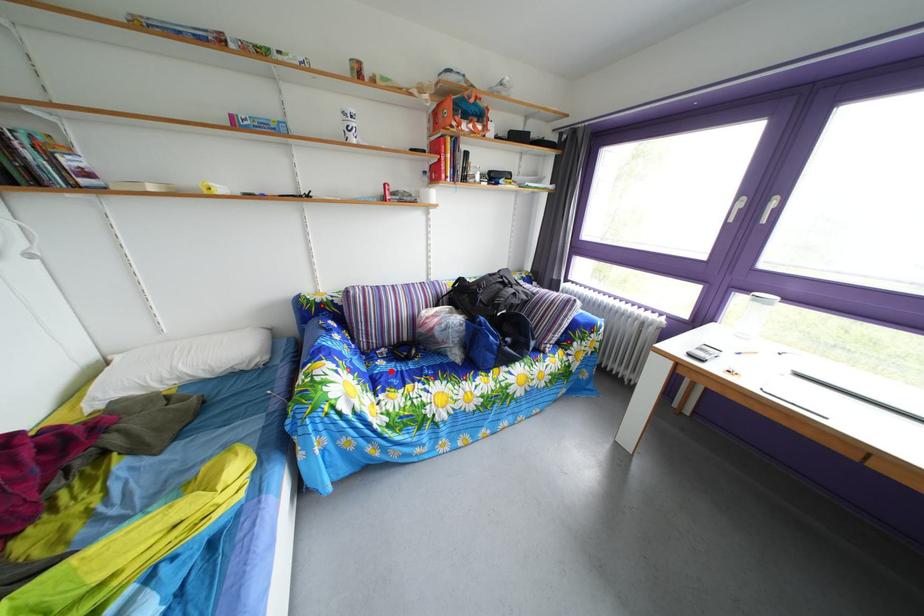
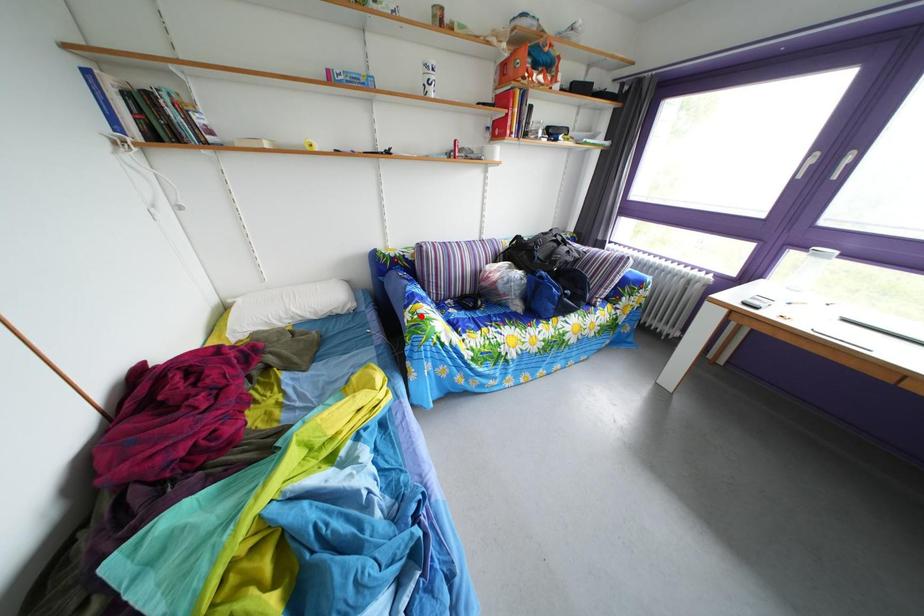
I am providing you with two images of the same scene from different viewpoints. A red point is marked on the first image and another point is marked on the second image. Does the point marked in image1 correspond to the same location as the one in image2?

No